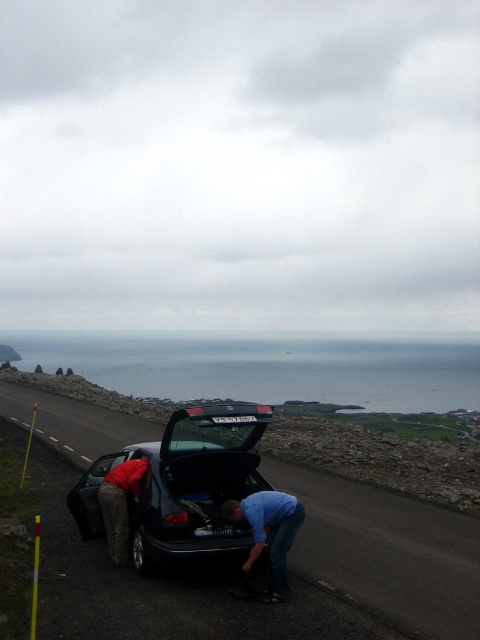
Question: Is blue denim jeans at lower center below camouflage pants at lower left?

Choices:
 (A) yes
 (B) no

Answer: (A)

Question: Does black matte car at center have a smaller size compared to blue denim jeans at lower center?

Choices:
 (A) yes
 (B) no

Answer: (A)

Question: Considering the real-world distances, which object is farthest from the blue denim jeans at lower center?

Choices:
 (A) black matte car at center
 (B) camouflage pants at lower left

Answer: (A)

Question: Which object is closer to the camera taking this photo?

Choices:
 (A) camouflage pants at lower left
 (B) blue denim jeans at lower center
 (C) black matte car at center

Answer: (B)

Question: Which point is farther to the camera?

Choices:
 (A) black matte car at center
 (B) camouflage pants at lower left

Answer: (A)

Question: Is black matte car at center wider than blue denim jeans at lower center?

Choices:
 (A) yes
 (B) no

Answer: (B)